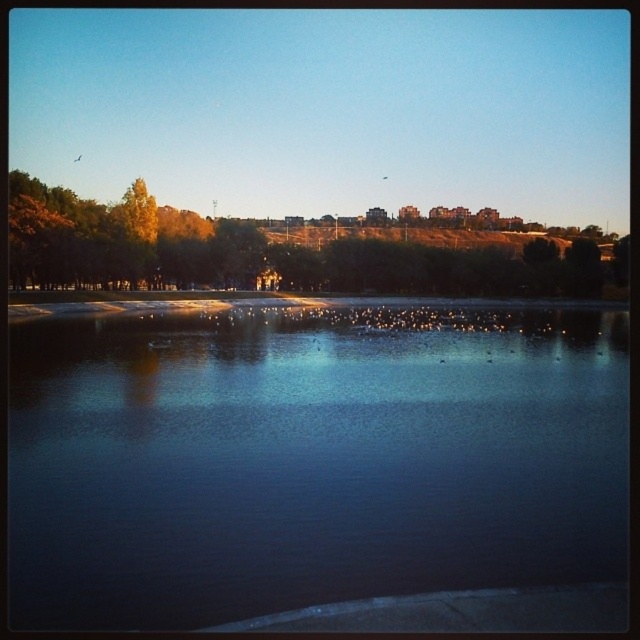
Can you confirm if dark reflective water at center is thinner than green leafy trees at upper center?

Yes.

Does dark reflective water at center appear on the left side of green leafy trees at upper center?

Yes, dark reflective water at center is to the left of green leafy trees at upper center.

Between point (125, 445) and point (513, 273), which one is positioned behind?

Point (513, 273)

Locate an element on the screen. dark reflective water at center is located at coordinates (308, 456).